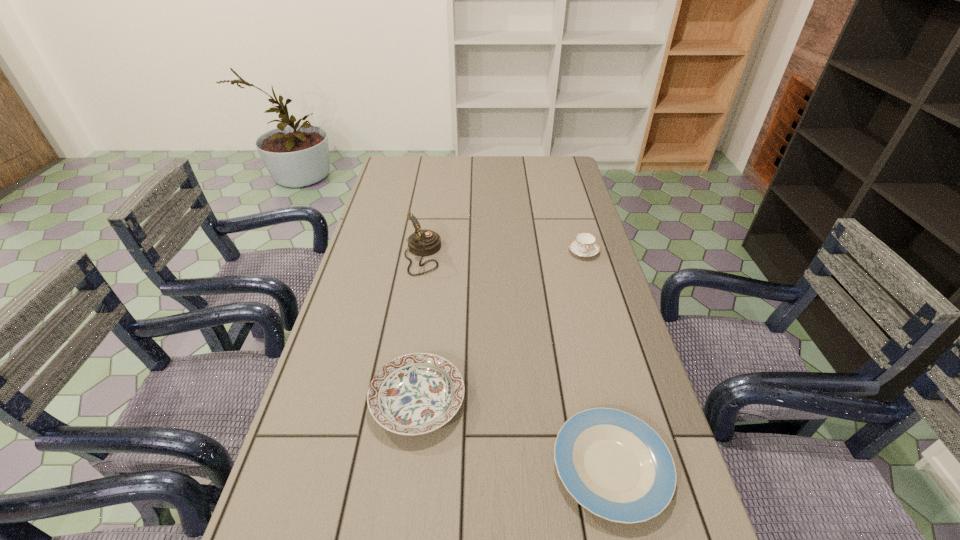
I want to click on telephone at the left edge, so click(x=424, y=242).

Identify the location of plate positioned at the left edge. This screenshot has height=540, width=960. (414, 394).

You are a GUI agent. You are given a task and a screenshot of the screen. Output one action in this format:
    pyautogui.click(x=<x>, y=<y>)
    Task: Click on the teacup situated at the right edge
    
    Given the screenshot: What is the action you would take?
    pyautogui.click(x=584, y=245)

I want to click on plate located in the right edge section of the desktop, so click(615, 465).

I want to click on free space at the far edge of the desktop, so click(x=516, y=174).

This screenshot has width=960, height=540. I want to click on vacant space at the left edge, so click(392, 237).

Image resolution: width=960 pixels, height=540 pixels. Identify the location of vacant space at the right edge. click(x=567, y=232).

At what (x,y) coordinates should I click in order to perform the action: click on vacant space at the far left corner of the desktop. Please return your answer as a coordinate pair (x, y). Looking at the image, I should click on (398, 164).

The image size is (960, 540). I want to click on free location at the far right corner, so click(x=559, y=167).

Find the location of a particular element. free space between the second shortest object and the teacup is located at coordinates (500, 326).